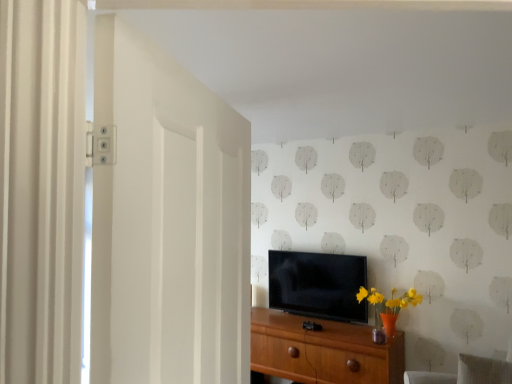
Question: Considering the positions of gray fabric swivel chair at lower right and wooden chest of drawers at center in the image, is gray fabric swivel chair at lower right wider or thinner than wooden chest of drawers at center?

Choices:
 (A) thin
 (B) wide

Answer: (A)

Question: Which is correct: gray fabric swivel chair at lower right is inside wooden chest of drawers at center, or outside of it?

Choices:
 (A) inside
 (B) outside

Answer: (B)

Question: Which object is the farthest from the wooden chest of drawers at center?

Choices:
 (A) gray fabric swivel chair at lower right
 (B) white matte door at left
 (C) black glossy tv at center

Answer: (B)

Question: Which object is positioned closest to the black glossy tv at center?

Choices:
 (A) wooden chest of drawers at center
 (B) gray fabric swivel chair at lower right
 (C) white matte door at left

Answer: (A)